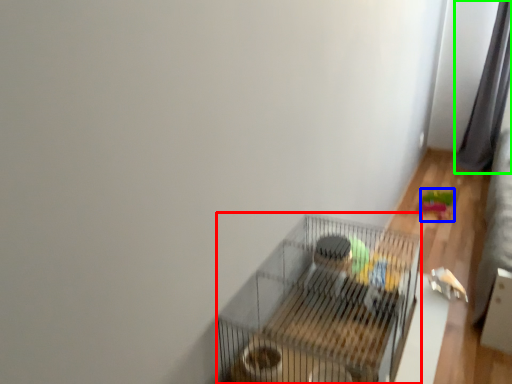
Question: Which object is positioned closest to bird cage (highlighted by a red box)? Select from toy (highlighted by a blue box) and curtain (highlighted by a green box).

Choices:
 (A) toy
 (B) curtain

Answer: (A)